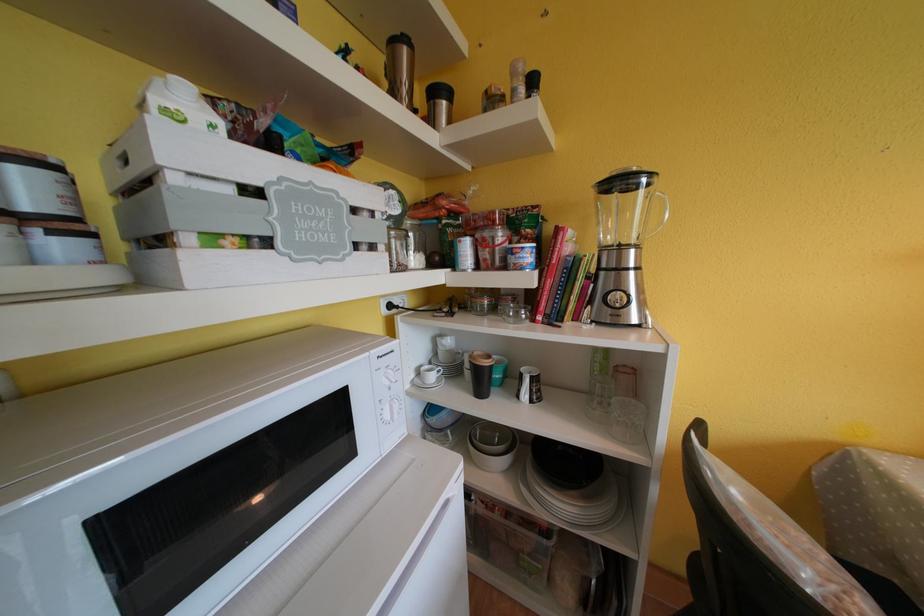
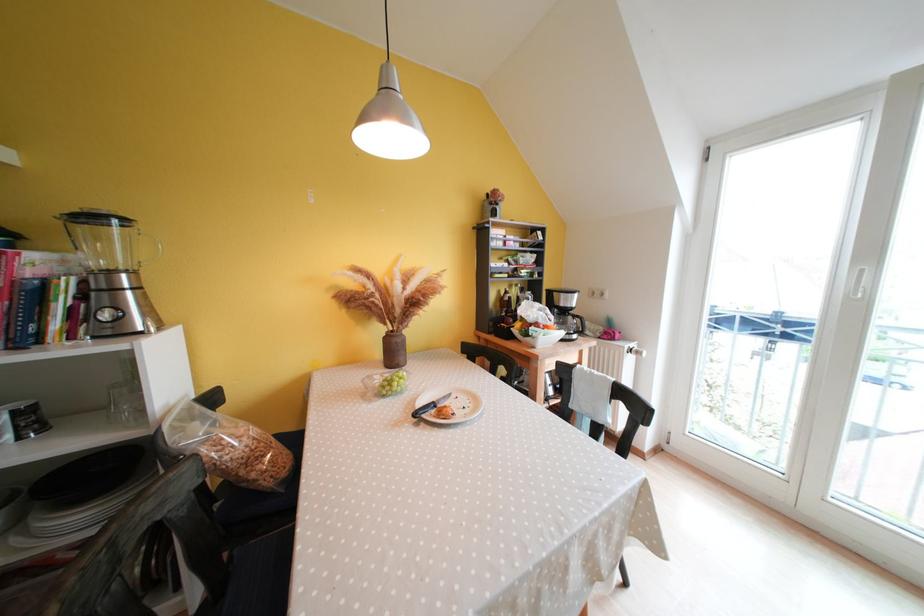
The point at (634, 300) is marked in the first image. Where is the corresponding point in the second image?

(132, 315)